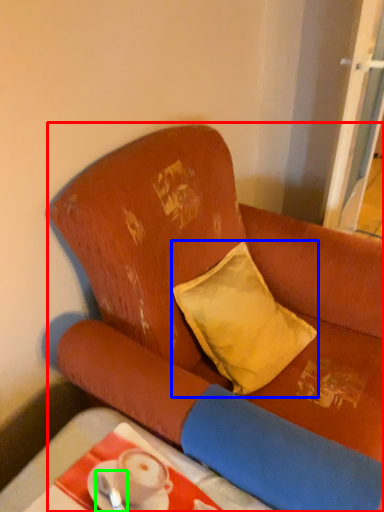
Question: Considering the real-world distances, which object is farthest from studio couch (highlighted by a red box)? pillow (highlighted by a blue box) or tableware (highlighted by a green box)?

Choices:
 (A) pillow
 (B) tableware

Answer: (B)